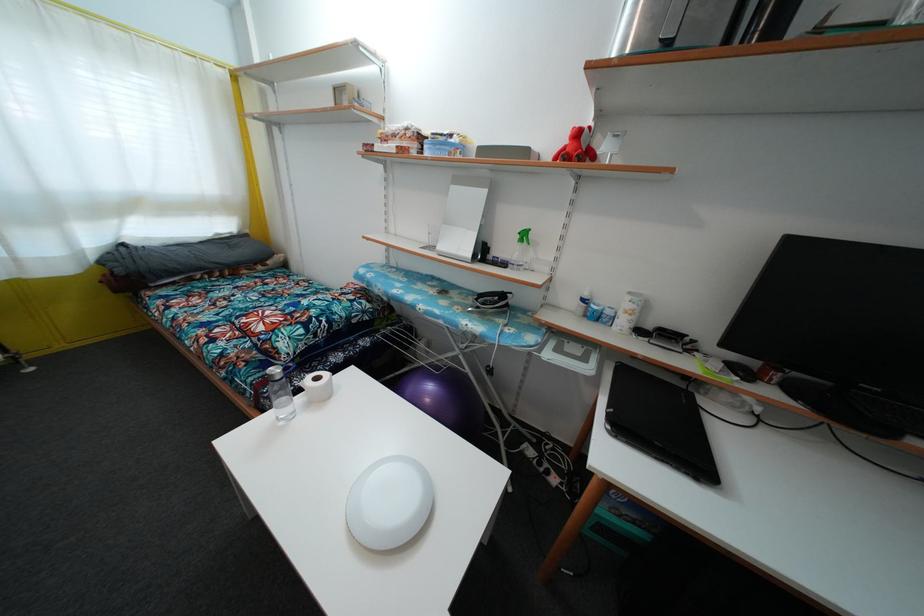
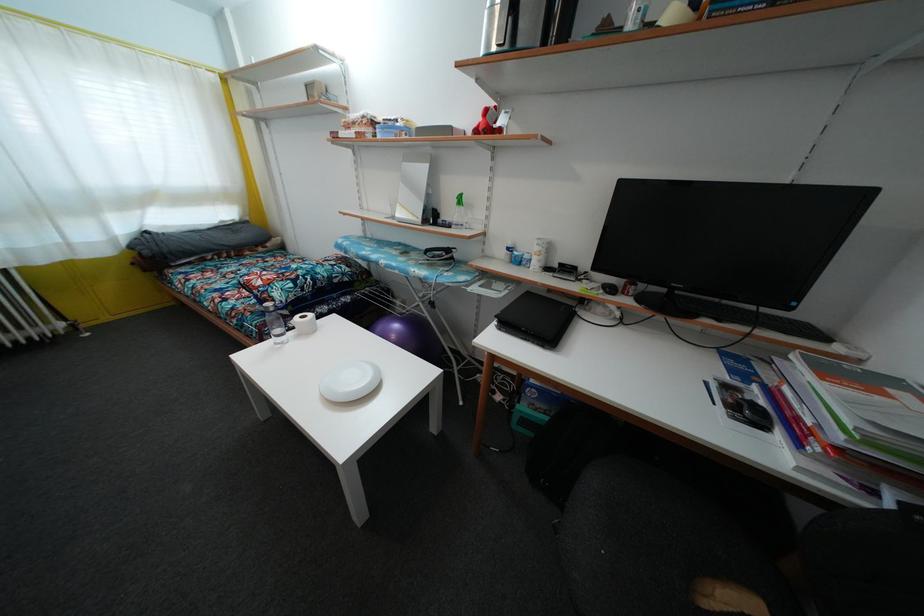
Find the pixel in the second image that matches [459,188] in the first image.

(410, 164)